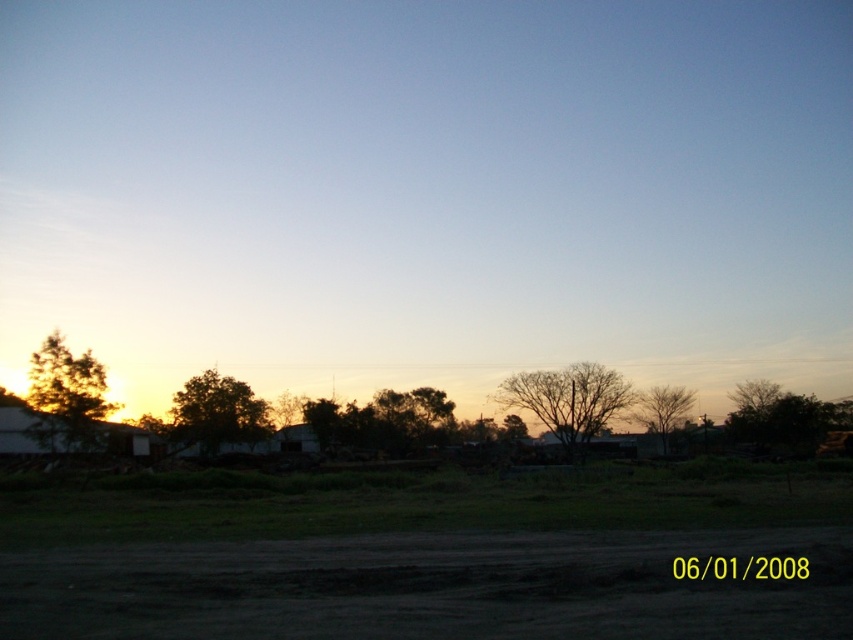
You are standing at the origin point of the coordinate system placed at the bottom left corner of the image. You want to walk to the green leafy tree at center. Which direction should you move in terms of x and y coordinates?

You should move towards the positive x and positive y directions since the green leafy tree at center is located at point 0.647 in the x direction and 0.254 in the y direction from the origin at the bottom left corner.